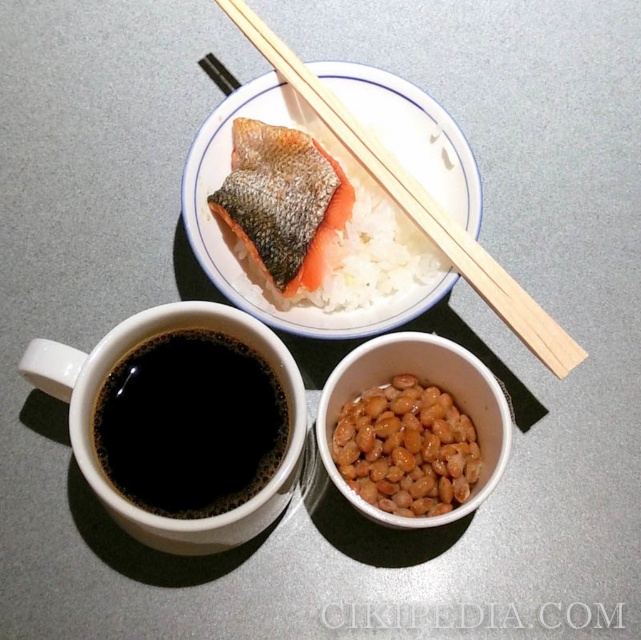
Question: Which object is farther from the camera taking this photo?

Choices:
 (A) brown matte beans at center
 (B) wooden chopsticks at upper center
 (C) black matte cup at lower left
 (D) pinkish-orange flesh at upper center

Answer: (D)

Question: In this image, where is brown matte beans at center located relative to wooden chopsticks at upper center?

Choices:
 (A) right
 (B) left

Answer: (A)

Question: Can you confirm if pinkish-orange flesh at upper center is bigger than wooden chopsticks at upper center?

Choices:
 (A) yes
 (B) no

Answer: (B)

Question: Does pinkish-orange flesh at upper center appear on the right side of wooden chopsticks at upper center?

Choices:
 (A) yes
 (B) no

Answer: (B)

Question: Which of the following is the farthest from the observer?

Choices:
 (A) (419, 392)
 (B) (445, 212)
 (C) (338, 216)
 (D) (199, 449)

Answer: (C)

Question: Among these objects, which one is farthest from the camera?

Choices:
 (A) wooden chopsticks at upper center
 (B) black matte cup at lower left
 (C) brown matte beans at center
 (D) pinkish-orange flesh at upper center

Answer: (D)